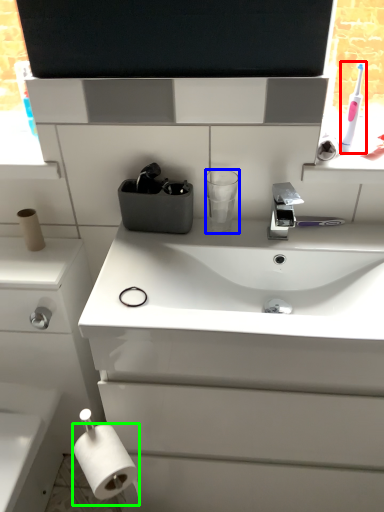
Question: Based on their relative distances, which object is farther from toothbrush (highlighted by a red box)? Choose from cup (highlighted by a blue box) and toilet paper (highlighted by a green box).

Choices:
 (A) cup
 (B) toilet paper

Answer: (B)